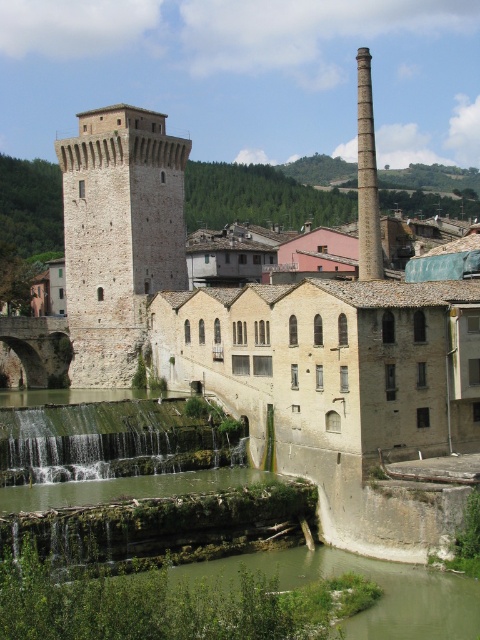
You are a drone operator tasked with capturing aerial footage of the historic town. Your drone has a maximum flight range of 40 meters. You need to fly from the smooth stone chimney at upper center to the smooth gray chimney at upper right. Can your drone complete this flight without needing to recharge?

The smooth stone chimney at upper center is 37.50 meters from the smooth gray chimney at upper right. Since the drone has a maximum flight range of 40 meters, it can complete the flight between the smooth stone chimney at upper center and the smooth gray chimney at upper right without needing to recharge.

You are standing at the base of the tower and want to locate the smooth stone chimney at upper center. Based on the coordinates provided, in which direction should you look relative to the tower?

The smooth stone chimney at upper center is located at coordinates point (x=119, y=236), which places it to the right and slightly above the tower. Therefore, you should look to the right and slightly upward from the tower to find the smooth stone chimney at upper center.